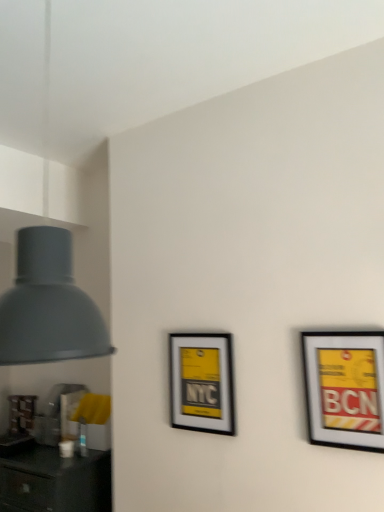
Question: Based on their sizes in the image, would you say matte black picture frame at center, the second picture frame positioned from the right, is bigger or smaller than matte black picture frame at right, acting as the first picture frame starting from the front?

Choices:
 (A) big
 (B) small

Answer: (A)

Question: From the image's perspective, is matte black picture frame at center, the second picture frame positioned from the right, positioned above or below matte black picture frame at right, acting as the second picture frame starting from the back?

Choices:
 (A) above
 (B) below

Answer: (B)

Question: Estimate the real-world distances between objects in this image. Which object is closer to the matte black picture frame at center, the second picture frame positioned from the right?

Choices:
 (A) matte black picture frame at right, acting as the first picture frame starting from the front
 (B) matte gray lampshade at left

Answer: (A)

Question: Which object is positioned farthest from the matte gray lampshade at left?

Choices:
 (A) matte black picture frame at right, the 2th picture frame in the left-to-right sequence
 (B) matte black picture frame at center, which ranks as the first picture frame in back-to-front order

Answer: (B)